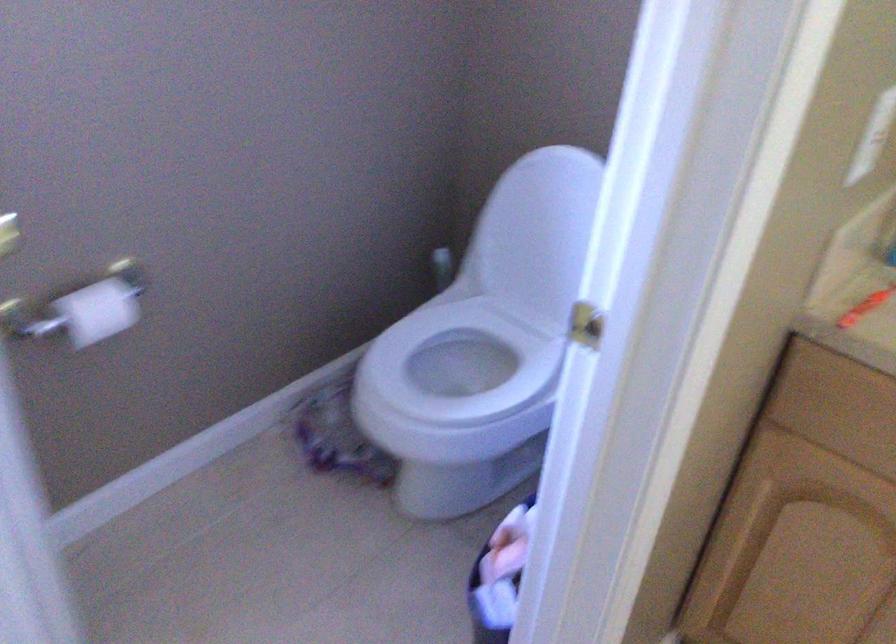
Locate an element on the screen. This screenshot has height=644, width=896. toilet flush lever is located at coordinates pyautogui.click(x=442, y=268).